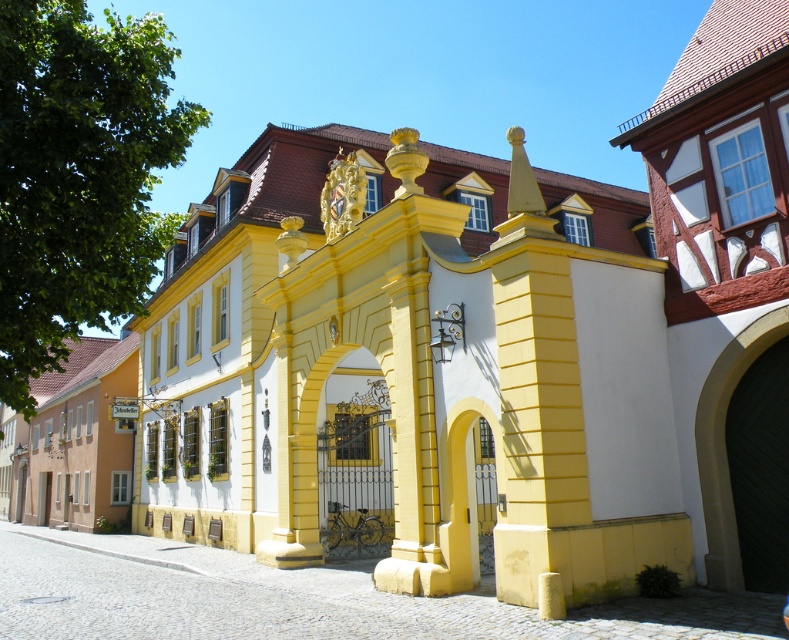
Question: In this image, where is beige stone archway at center located relative to yellow matte gate at center?

Choices:
 (A) above
 (B) below

Answer: (A)

Question: Is beige stone archway at center bigger than yellow matte gate at center?

Choices:
 (A) yes
 (B) no

Answer: (A)

Question: Which point is closer to the camera taking this photo?

Choices:
 (A) (724, 557)
 (B) (470, 483)

Answer: (A)

Question: From the image, what is the correct spatial relationship of beige stone archway at center in relation to yellow matte gate at center?

Choices:
 (A) below
 (B) above

Answer: (B)

Question: Which point is closer to the camera?

Choices:
 (A) yellow matte gate at center
 (B) beige stone archway at center

Answer: (B)